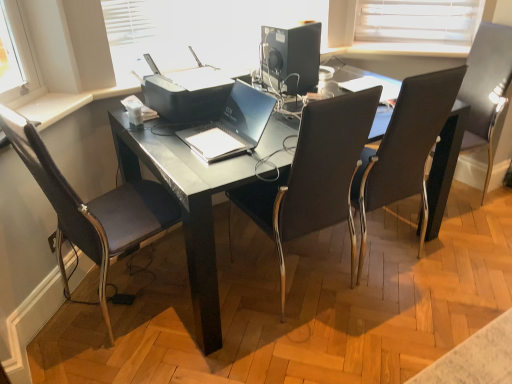
Find the location of a particular element. free space in front of black leather chair at center, placed as the third chair when sorted from left to right is located at coordinates (399, 310).